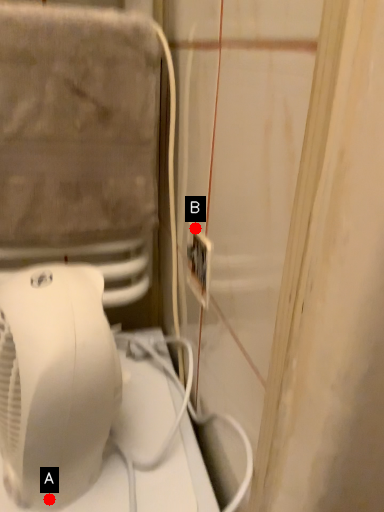
Question: Two points are circled on the image, labeled by A and B beside each circle. Which point is farther from the camera taking this photo?

Choices:
 (A) A is further
 (B) B is further

Answer: (B)